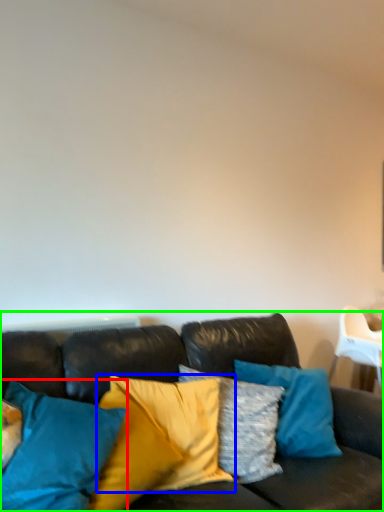
Question: Which object is positioned closest to pillow (highlighted by a red box)? Select from pillow (highlighted by a blue box) and studio couch (highlighted by a green box).

Choices:
 (A) pillow
 (B) studio couch

Answer: (B)